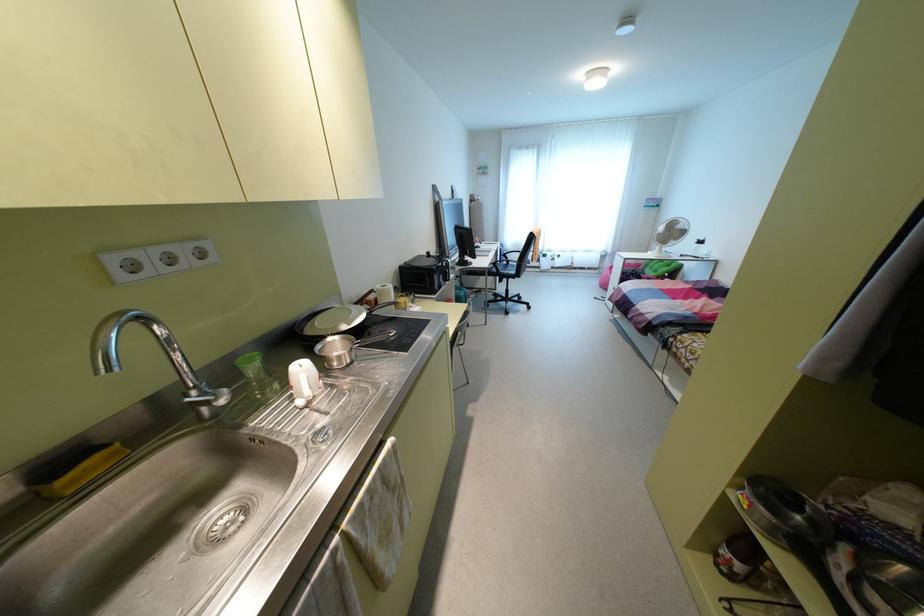
Find the location of a particular element. The height and width of the screenshot is (616, 924). white kettle handle is located at coordinates (308, 384).